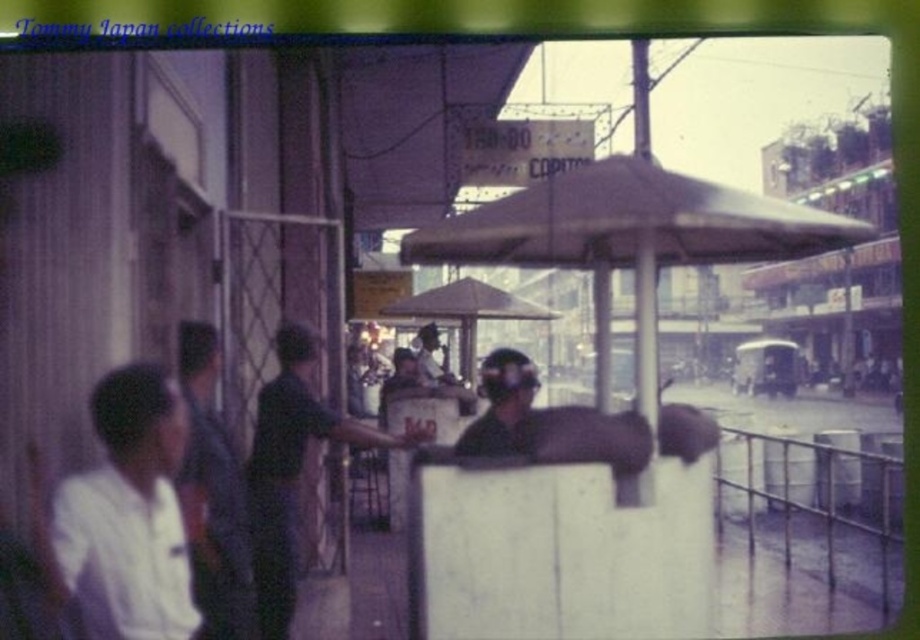
From the picture: You are a photographer trying to capture the brown matte umbrella at center in your shot. Based on the scene description, where should you position your camera to ensure the umbrella is centered in the frame?

The brown matte umbrella at center is already positioned at the center of the image at coordinates approximately (466, 310), so positioning the camera to aim directly at this central point will ensure the umbrella is centered in the frame.

Based on the photo, you are a customer at the food stall and want to order a drink. The vendor is wearing a dark blue shirt at center. Where should you look to see the brown matte umbrella at center that provides shade?

The brown matte umbrella at center is above the dark blue shirt at center, so you should look above the vendor wearing the dark blue shirt at center to find the umbrella providing shade.

You are standing at the food stall and want to walk towards the point labeled point (78, 529). Which direction should you go relative to the other point, point (205, 568)?

Point (78, 529) is in front of point (205, 568), so you should walk towards the direction of point (78, 529) which is in front of point (205, 568).